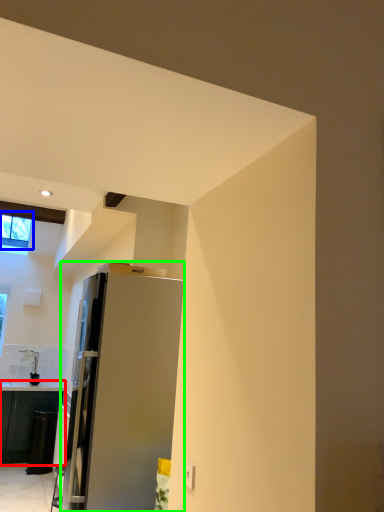
Question: Estimate the real-world distances between objects in this image. Which object is farther from cabinetry (highlighted by a red box), window (highlighted by a blue box) or refrigerator (highlighted by a green box)?

Choices:
 (A) window
 (B) refrigerator

Answer: (B)